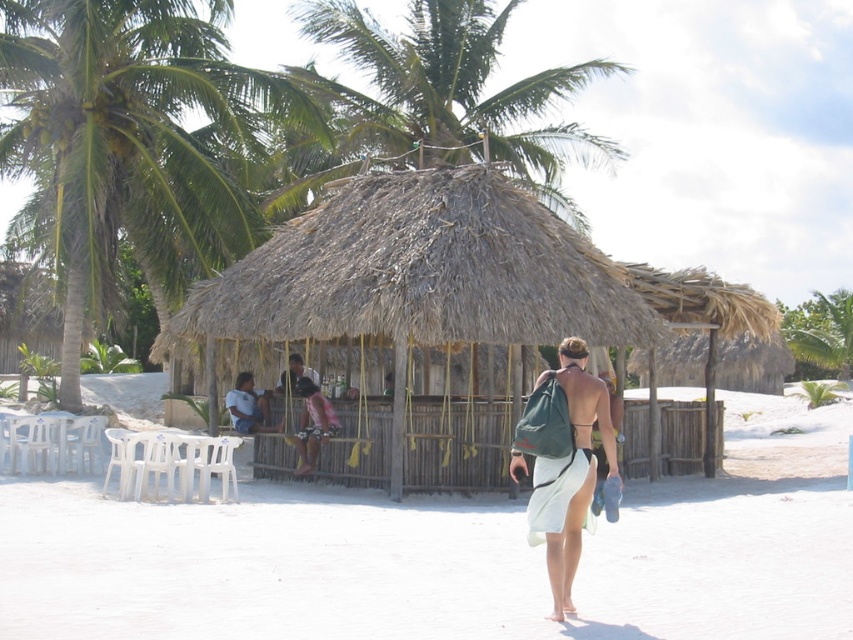
Looking at this image, you are standing on the beach and want to take a photo of the green leafy palm tree at upper center and the green fabric backpack at center. Which object should you position to the right side of your camera frame?

You should position the green leafy palm tree at upper center to the right side of your camera frame because it is already located to the right of the green fabric backpack at center.

You are standing at the center of the beach scene and want to place a new bench exactly where the white plastic chairs at lower left are located. What are the coordinates where you should place the bench?

The coordinates for the white plastic chairs at lower left are at point (450,556), so you should place the bench at those coordinates.

You are a photographer trying to capture the green leafy palm tree at upper center and the green fabric backpack at center in the same frame. Which object will appear wider in the photo?

The green leafy palm tree at upper center will appear wider in the photo because its width surpasses that of the green fabric backpack at center.